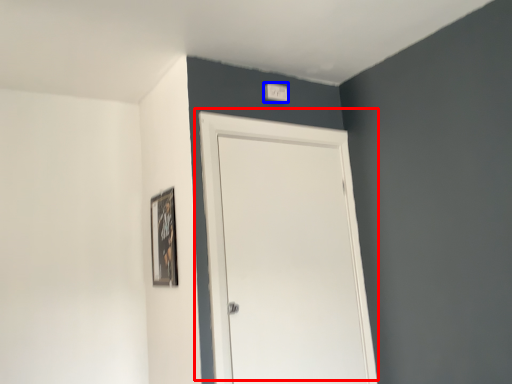
Question: Among these objects, which one is nearest to the camera, door (highlighted by a red box) or light switch (highlighted by a blue box)?

Choices:
 (A) door
 (B) light switch

Answer: (A)